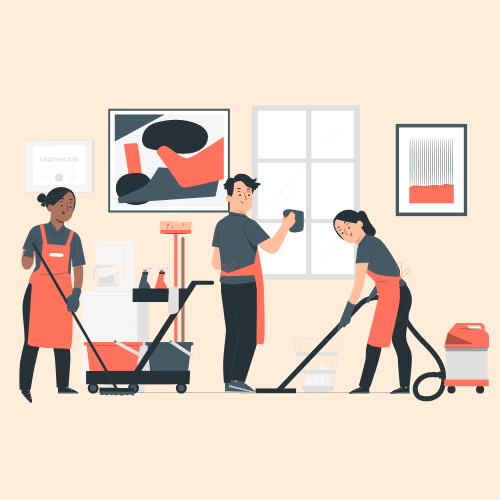
Identify the location of vacuum cleaner. The image size is (500, 500). (460, 348).